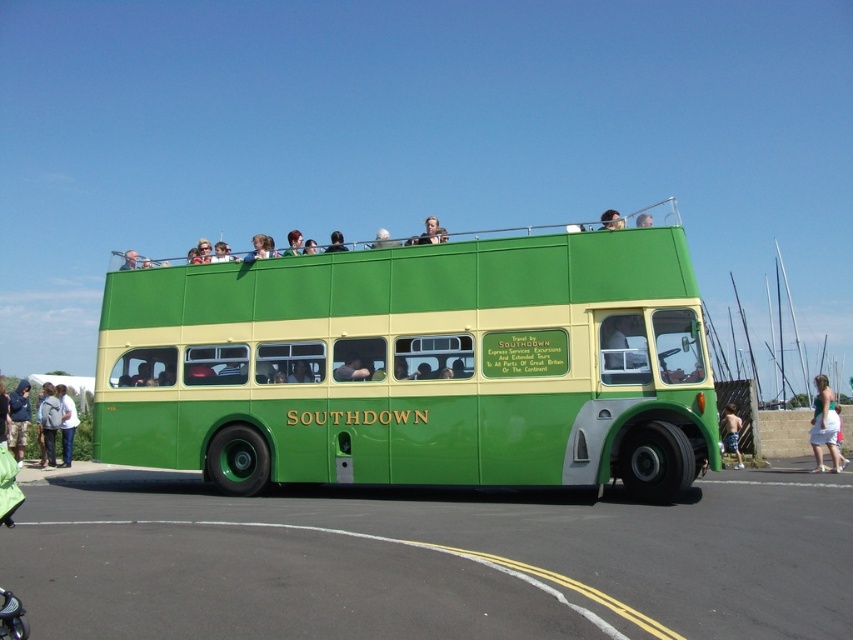
Question: Does white cotton skirt at lower right have a lesser width compared to blue denim shorts at lower right?

Choices:
 (A) no
 (B) yes

Answer: (A)

Question: Is dark blue jacket at lower left to the left of blue denim shorts at lower right from the viewer's perspective?

Choices:
 (A) yes
 (B) no

Answer: (A)

Question: Among these points, which one is nearest to the camera?

Choices:
 (A) (26, 388)
 (B) (398, 422)
 (C) (735, 458)
 (D) (70, 426)

Answer: (B)

Question: Which of the following is the closest to the observer?

Choices:
 (A) (74, 428)
 (B) (726, 449)
 (C) (22, 413)
 (D) (41, 428)

Answer: (B)

Question: Which point is farther to the camera?

Choices:
 (A) (543, 376)
 (B) (22, 444)
 (C) (821, 387)
 (D) (68, 424)

Answer: (D)

Question: Is light gray backpack at lower left positioned in front of light blue jeans at lower left?

Choices:
 (A) no
 (B) yes

Answer: (B)